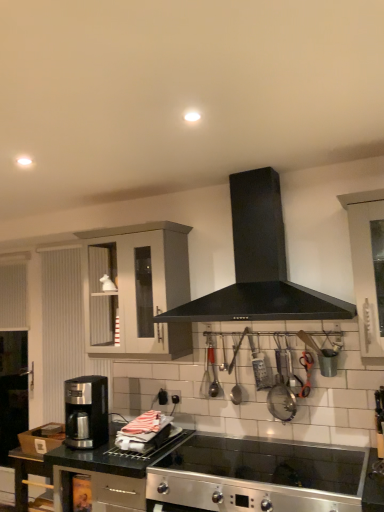
Image resolution: width=384 pixels, height=512 pixels. What are the coordinates of `empty space that is ontop of stainless steel cooktop at lower center, the 2th countertop from the left (from a real-world perspective)` in the screenshot? It's located at (252, 462).